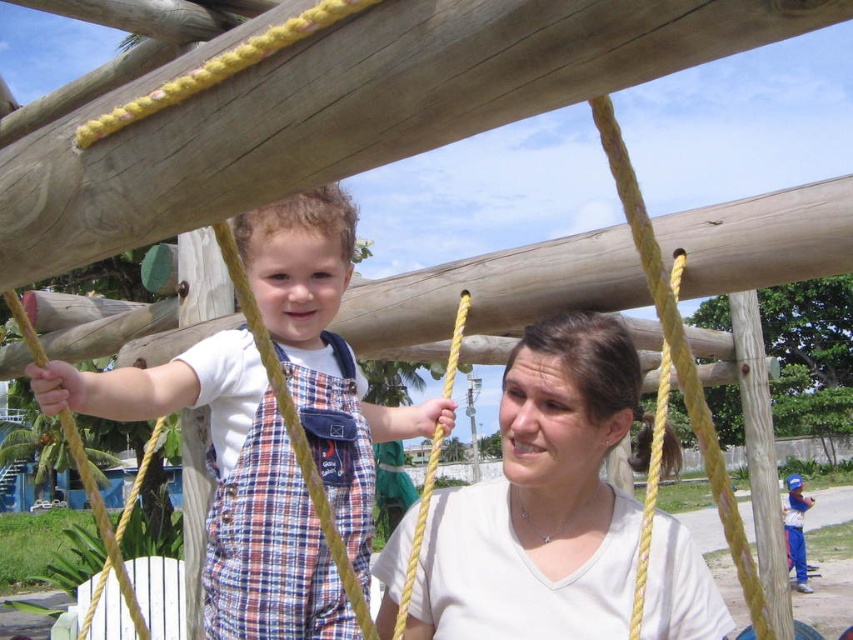
Question: Can you confirm if plaid cotton overalls at left is thinner than blue denim pants at lower right?

Choices:
 (A) no
 (B) yes

Answer: (A)

Question: Does white matte shirt at center appear over blue denim pants at lower right?

Choices:
 (A) yes
 (B) no

Answer: (A)

Question: Which object is the closest to the blue denim pants at lower right?

Choices:
 (A) plaid cotton overalls at left
 (B) plaid overalls at center
 (C) white matte shirt at center

Answer: (C)

Question: Which point appears farthest from the camera in this image?

Choices:
 (A) (788, 509)
 (B) (583, 339)
 (C) (221, 349)
 (D) (311, 586)

Answer: (A)

Question: Which of these objects is positioned closest to the plaid cotton overalls at left?

Choices:
 (A) blue denim pants at lower right
 (B) white matte shirt at center

Answer: (B)

Question: From the image, what is the correct spatial relationship of white matte shirt at center in relation to plaid cotton overalls at left?

Choices:
 (A) below
 (B) above

Answer: (A)